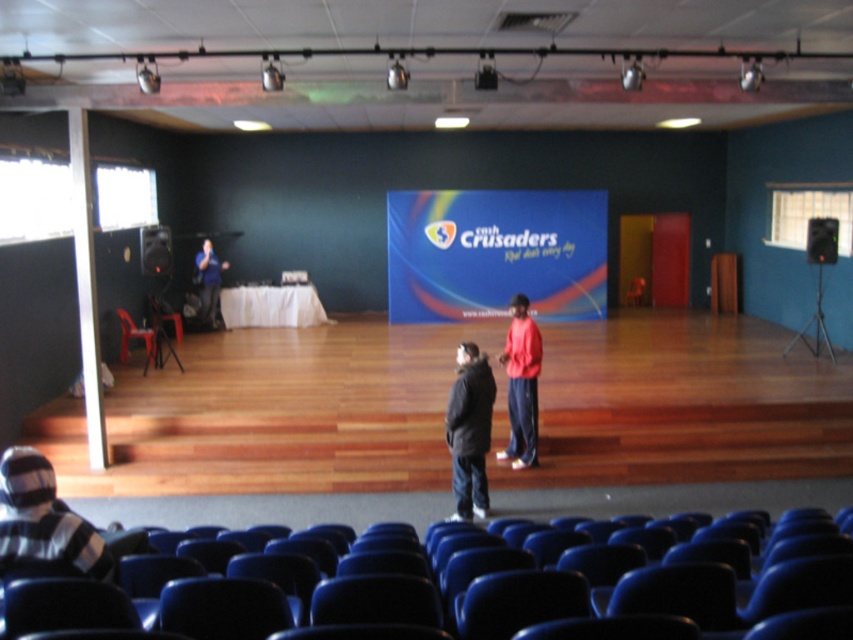
You are an event planner setting up a stage for a presentation. You need to place a new banner to the right of the matte black shirt at left. Will the blue fabric screen at center interfere with this placement?

The blue fabric screen at center is positioned on the right side of the matte black shirt at left, so placing the banner to the right of the matte black shirt at left would place it next to the blue fabric screen at center. Therefore, the blue fabric screen at center may interfere with the placement unless moved.

You are standing in the front row of the audience facing the stage. You want to throw a small object to the striped knit hat at lower left. Is the distance feasible for an average person to reach?

The striped knit hat at lower left is 10.25 feet away from viewer. An average person can throw a small object up to about 15 feet, so it is feasible to reach the striped knit hat at lower left.

You are an event organizer checking the stage setup. You need to ensure that the blue fabric screen at center and the matte black shirt at left are positioned correctly. Based on their sizes, which object should be placed in a position where height is a critical factor?

The blue fabric screen at center should be placed where height is critical because it is much taller than the matte black shirt at left.